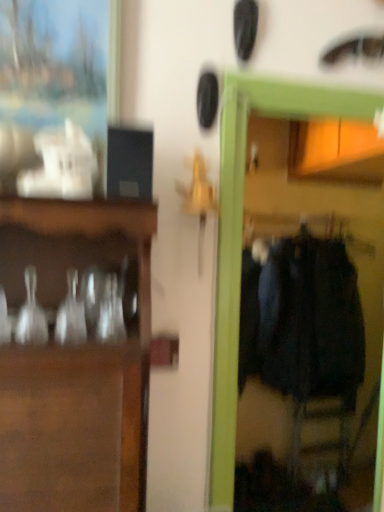
Locate an element on the screen. clear glass vase at left is located at coordinates pos(31,314).

The image size is (384, 512). What do you see at coordinates (31, 314) in the screenshot? I see `clear glass vase at left` at bounding box center [31, 314].

The image size is (384, 512). In order to click on dark blue fabric coat at right in this screenshot , I will do `click(302, 320)`.

What do you see at coordinates (302, 320) in the screenshot?
I see `dark blue fabric coat at right` at bounding box center [302, 320].

Locate an element on the screen. clear glass vase at left is located at coordinates (31, 314).

Does clear glass vase at left appear on the left side of dark blue fabric coat at right?

Indeed, clear glass vase at left is positioned on the left side of dark blue fabric coat at right.

Is clear glass vase at left behind dark blue fabric coat at right?

No.

Which point is more forward, (26,286) or (318,378)?

The point (26,286) is closer.

From the image's perspective, between clear glass vase at left and dark blue fabric coat at right, which one is located above?

clear glass vase at left is shown above in the image.

From a real-world perspective, who is located higher, clear glass vase at left or dark blue fabric coat at right?

From a 3D spatial view, clear glass vase at left is above.

Considering the sizes of objects clear glass vase at left and dark blue fabric coat at right in the image provided, who is wider, clear glass vase at left or dark blue fabric coat at right?

dark blue fabric coat at right is wider.

Is clear glass vase at left shorter than dark blue fabric coat at right?

Yes.

Considering the sizes of objects clear glass vase at left and dark blue fabric coat at right in the image provided, who is bigger, clear glass vase at left or dark blue fabric coat at right?

dark blue fabric coat at right.

Is clear glass vase at left inside the boundaries of dark blue fabric coat at right, or outside?

clear glass vase at left lies outside dark blue fabric coat at right.

Is clear glass vase at left next to dark blue fabric coat at right?

No, clear glass vase at left is not next to dark blue fabric coat at right.

Is clear glass vase at left facing away from dark blue fabric coat at right?

That's not correct — clear glass vase at left is not looking away from dark blue fabric coat at right.

How many degrees apart are the facing directions of clear glass vase at left and dark blue fabric coat at right?

They differ by 1.7 degrees in their facing directions.

Image resolution: width=384 pixels, height=512 pixels. I want to click on clothing that appears behind the clear glass vase at left, so click(302, 320).

In the scene shown: Which is more to the left, dark blue fabric coat at right or clear glass vase at left?

Positioned to the left is clear glass vase at left.

Is the position of dark blue fabric coat at right less distant than that of clear glass vase at left?

No, the depth of dark blue fabric coat at right is greater than that of clear glass vase at left.

Is point (349, 340) positioned behind point (26, 335)?

Yes, point (349, 340) is farther from viewer.

From the image's perspective, is dark blue fabric coat at right above or below clear glass vase at left?

Clearly, from the image's perspective, dark blue fabric coat at right is below clear glass vase at left.

From a real-world perspective, between dark blue fabric coat at right and clear glass vase at left, who is vertically higher?

clear glass vase at left.

Does dark blue fabric coat at right have a lesser width compared to clear glass vase at left?

No.

In terms of height, does dark blue fabric coat at right look taller or shorter compared to clear glass vase at left?

Clearly, dark blue fabric coat at right is taller compared to clear glass vase at left.

Does dark blue fabric coat at right have a smaller size compared to clear glass vase at left?

Actually, dark blue fabric coat at right might be larger than clear glass vase at left.

Which is correct: dark blue fabric coat at right is inside clear glass vase at left, or outside of it?

dark blue fabric coat at right is not enclosed by clear glass vase at left.

Is there a large distance between dark blue fabric coat at right and clear glass vase at left?

Yes, dark blue fabric coat at right and clear glass vase at left are located far from each other.

Could you tell me if dark blue fabric coat at right is turned towards clear glass vase at left?

No.

How distant is dark blue fabric coat at right from clear glass vase at left?

They are 2.06 meters apart.

This screenshot has height=512, width=384. In order to click on glass vase that is above the dark blue fabric coat at right (from a real-world perspective) in this screenshot , I will do `click(31, 314)`.

The height and width of the screenshot is (512, 384). I want to click on clothing below the clear glass vase at left (from a real-world perspective), so click(x=302, y=320).

At what (x,y) coordinates should I click in order to perform the action: click on clothing behind the clear glass vase at left. Please return your answer as a coordinate pair (x, y). Looking at the image, I should click on (302, 320).